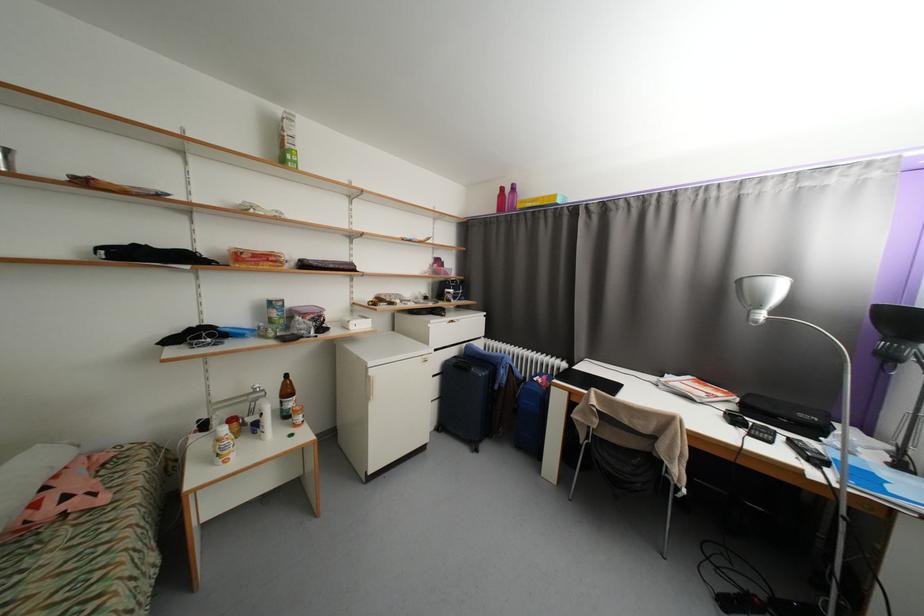
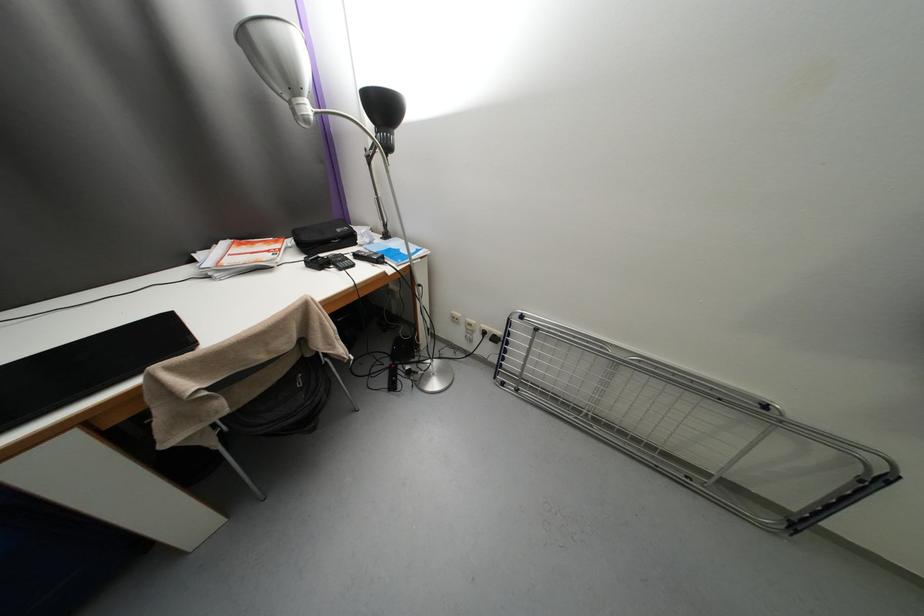
The first image is from the beginning of the video and the second image is from the end. How did the camera likely rotate when shooting the video?

The camera's rotation is toward right-down.